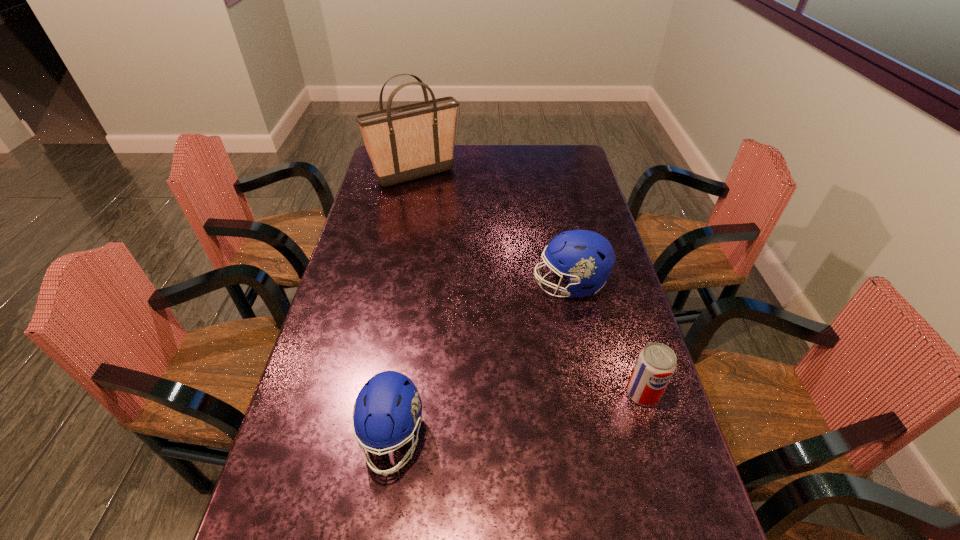
This screenshot has height=540, width=960. Find the location of `vacant space located 0.050m on the front-facing side of the left football helmet`. vacant space located 0.050m on the front-facing side of the left football helmet is located at coordinates pos(382,509).

Where is `vacant area situated 0.280m on the left of the soda`? vacant area situated 0.280m on the left of the soda is located at coordinates (513, 393).

Where is `object positioned at the far edge`? This screenshot has width=960, height=540. object positioned at the far edge is located at coordinates (404, 143).

In order to click on object present at the left edge in this screenshot , I will do `click(404, 143)`.

You are a GUI agent. You are given a task and a screenshot of the screen. Output one action in this format:
    pyautogui.click(x=<x>, y=<y>)
    Task: Click on the football helmet located in the right edge section of the desktop
    The image size is (960, 540).
    Given the screenshot: What is the action you would take?
    pyautogui.click(x=586, y=258)

Locate an element on the screen. Image resolution: width=960 pixels, height=540 pixels. soda located in the right edge section of the desktop is located at coordinates (656, 363).

Locate an element on the screen. This screenshot has height=540, width=960. object present at the far left corner is located at coordinates (404, 143).

This screenshot has height=540, width=960. What are the coordinates of `free space at the far edge of the desktop` in the screenshot? It's located at (480, 156).

Image resolution: width=960 pixels, height=540 pixels. Find the location of `vacant region at the left edge of the desktop`. vacant region at the left edge of the desktop is located at coordinates (399, 230).

The height and width of the screenshot is (540, 960). In the image, there is a desktop. In order to click on free region at the right edge in this screenshot , I will do `click(585, 179)`.